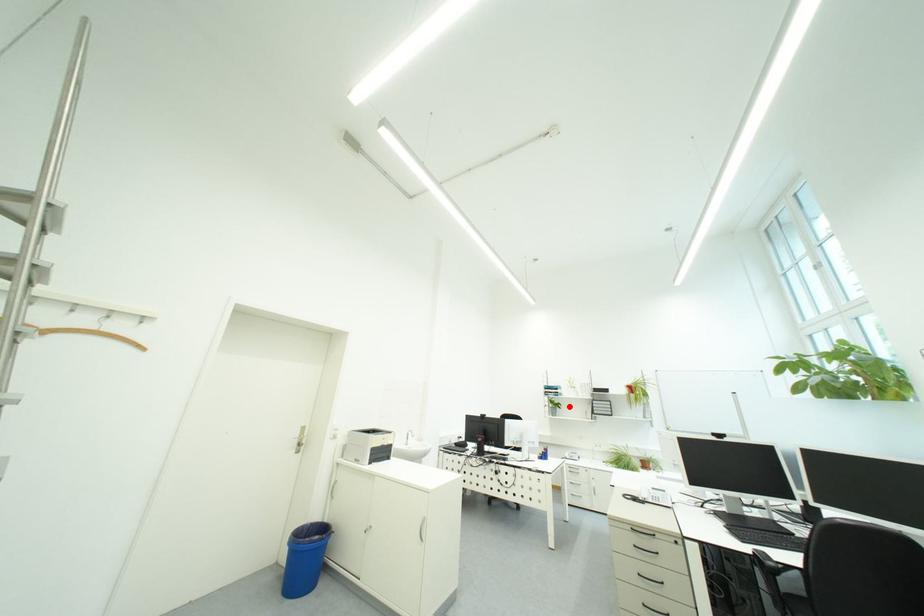
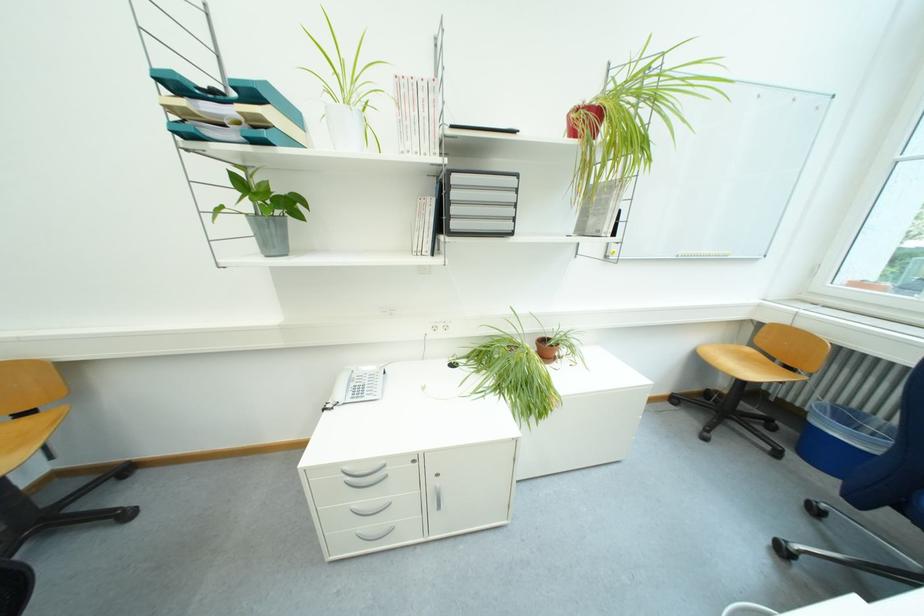
In the second image, find the point that corresponds to the highlighted location in the first image.

(302, 206)